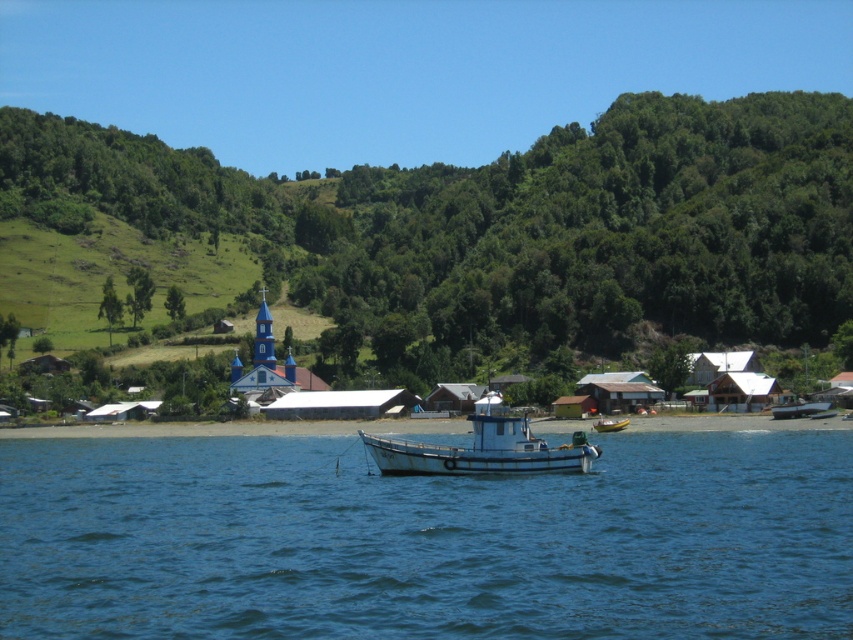
You are a photographer wanting to capture both the green grassy hillside at upper center and the white matte boat at center in a single shot. Based on their positions, which one should you focus on first to ensure both are in frame?

Since the green grassy hillside at upper center is to the left of the white matte boat at center, you should focus on the white matte boat at center first, then adjust the camera to include the green grassy hillside at upper center on the left side of the frame.

You are planning to take a photo of the yellow rubber boat at center from the green grassy hillside at upper center. Considering their relative heights, will you need to look downward or upward to frame the boat properly?

Since the green grassy hillside at upper center is much taller than the yellow rubber boat at center, you will need to look downward to frame the boat properly.